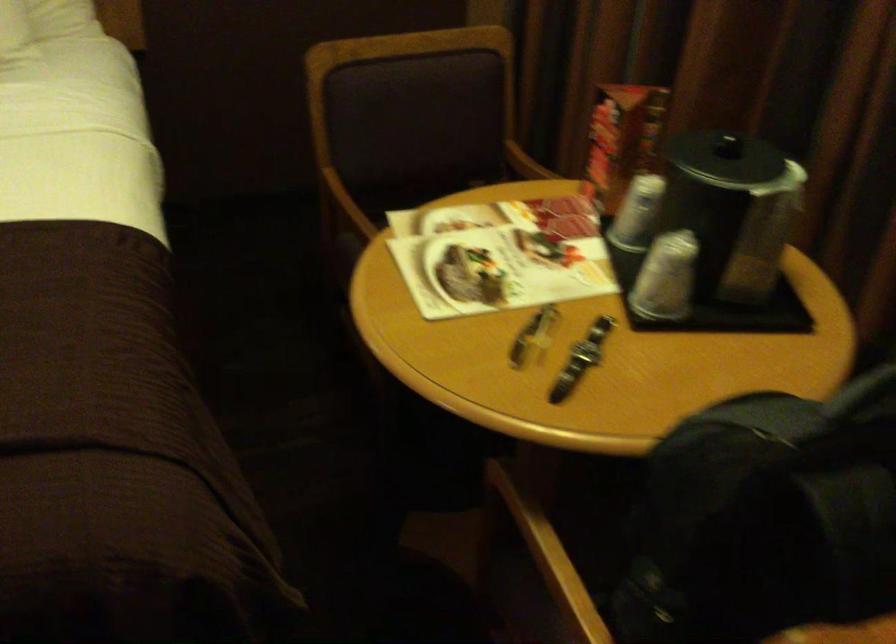
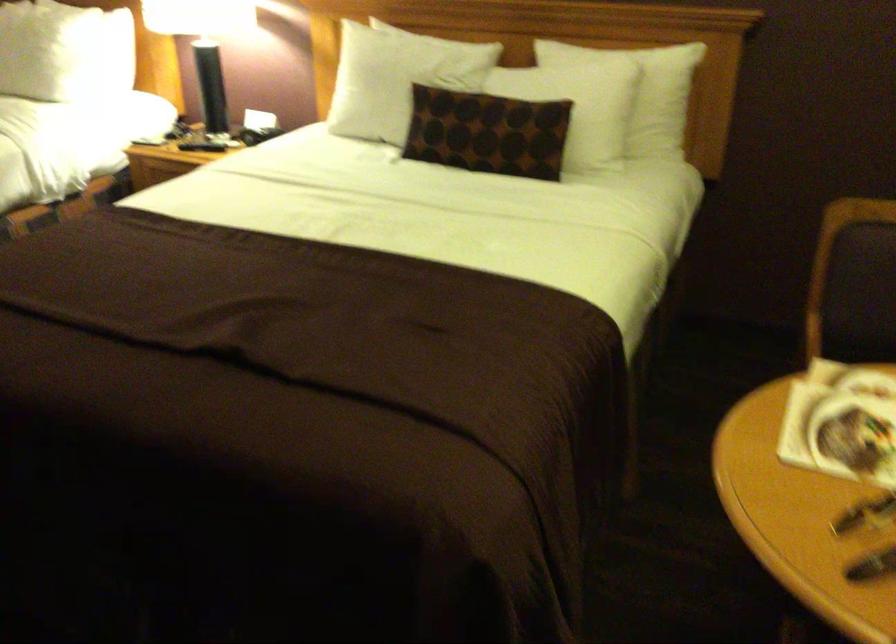
Question: How did the camera likely rotate?

Choices:
 (A) Left
 (B) Right
 (C) Up
 (D) Down

Answer: (A)